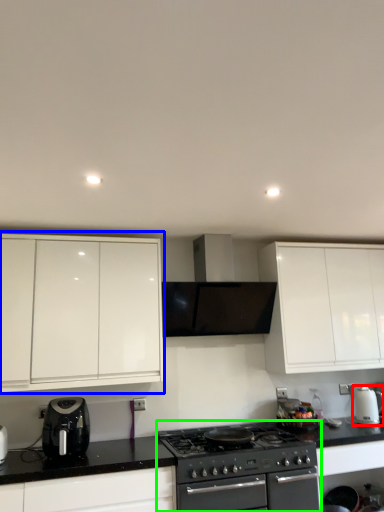
Question: Which is nearer to the kitchen appliance (highlighted by a red box)? cabinetry (highlighted by a blue box) or appliance (highlighted by a green box).

Choices:
 (A) cabinetry
 (B) appliance

Answer: (B)